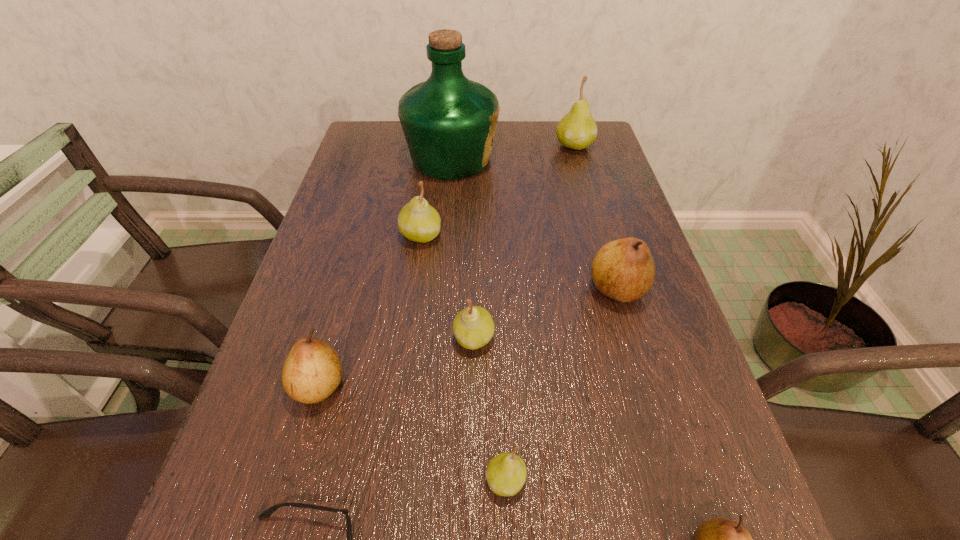
You are a GUI agent. You are given a task and a screenshot of the screen. Output one action in this format:
    pyautogui.click(x=<x>, y=<y>)
    Task: Click on the green liquor
    
    Given the screenshot: What is the action you would take?
    pyautogui.click(x=449, y=122)

Find the location of a particular element. The image size is (960, 540). liquor is located at coordinates (449, 122).

Locate an element on the screen. the biggest green pear is located at coordinates (577, 130).

Locate an element on the screen. The height and width of the screenshot is (540, 960). the rightmost green pear is located at coordinates (577, 130).

The height and width of the screenshot is (540, 960). I want to click on the leftmost green pear, so click(418, 221).

Identify the location of the second pear from left to right. (418, 221).

This screenshot has width=960, height=540. Identify the location of the third farthest pear. (624, 270).

The width and height of the screenshot is (960, 540). What are the coordinates of `the farthest brown pear` in the screenshot? It's located at (624, 270).

Locate an element on the screen. the leftmost pear is located at coordinates [312, 370].

Image resolution: width=960 pixels, height=540 pixels. Identify the location of the fourth nearest object. (312, 370).